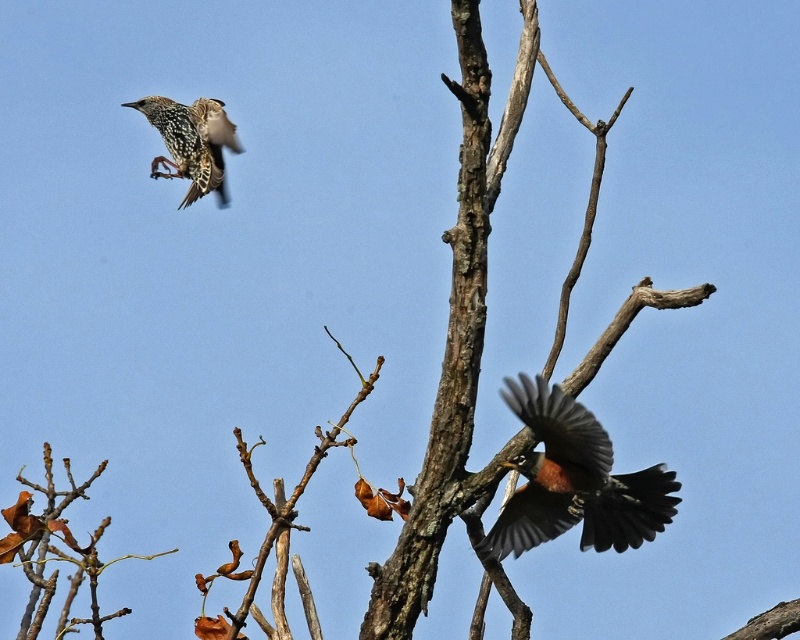
Question: Which object appears farthest from the camera in this image?

Choices:
 (A) bare branches at lower left
 (B) speckled feathered bird at upper left
 (C) reddish-brown feathered bird at lower right

Answer: (B)

Question: Is reddish-brown feathered bird at lower right wider than bare branches at lower left?

Choices:
 (A) no
 (B) yes

Answer: (A)

Question: Which point appears farthest from the camera in this image?

Choices:
 (A) (64, 532)
 (B) (184, 138)

Answer: (B)

Question: Does reddish-brown feathered bird at lower right appear on the right side of speckled feathered bird at upper left?

Choices:
 (A) yes
 (B) no

Answer: (A)

Question: Does reddish-brown feathered bird at lower right appear under speckled feathered bird at upper left?

Choices:
 (A) yes
 (B) no

Answer: (A)

Question: Which point is closer to the camera?

Choices:
 (A) reddish-brown feathered bird at lower right
 (B) speckled feathered bird at upper left

Answer: (A)